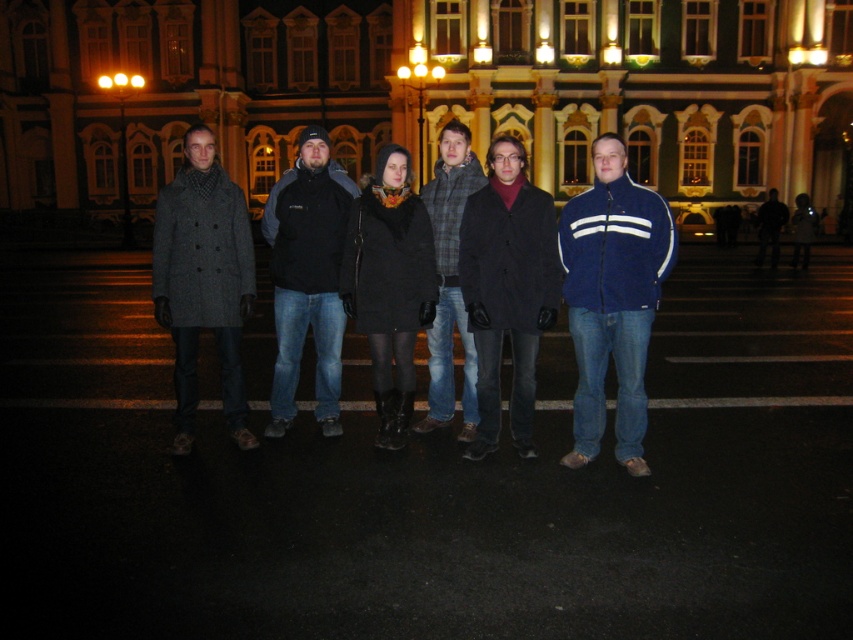
Can you confirm if matte black coat at center is positioned to the right of dark gray wool coat at center?

Yes, matte black coat at center is to the right of dark gray wool coat at center.

Does point (495, 168) lie behind point (193, 252)?

That is True.

The height and width of the screenshot is (640, 853). Identify the location of matte black coat at center. [508, 289].

Is dark gray wool coat at center thinner than plaid wool sweater at center?

In fact, dark gray wool coat at center might be wider than plaid wool sweater at center.

Does point (231, 211) lie behind point (465, 403)?

Yes.

At what (x,y) coordinates should I click in order to perform the action: click on dark gray wool coat at center. Please return your answer as a coordinate pair (x, y). The image size is (853, 640). Looking at the image, I should click on (202, 280).

Between dark gray wool coat at center and dark gray fleece jacket at center, which one has less height?

Standing shorter between the two is dark gray wool coat at center.

Which is more to the left, dark gray wool coat at center or dark gray fleece jacket at center?

From the viewer's perspective, dark gray wool coat at center appears more on the left side.

Who is more forward, (233, 332) or (273, 195)?

Point (233, 332)

Where is `dark gray wool coat at center`? This screenshot has height=640, width=853. dark gray wool coat at center is located at coordinates (202, 280).